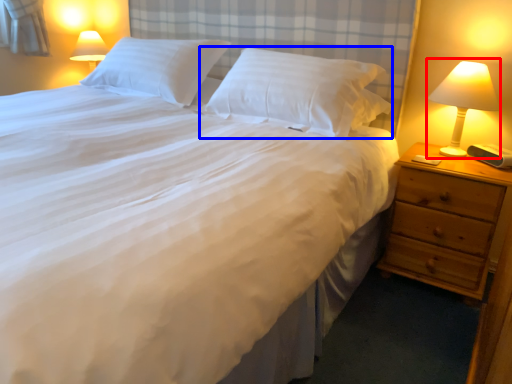
Question: Among these objects, which one is nearest to the camera, bedside lamp (highlighted by a red box) or pillow (highlighted by a blue box)?

Choices:
 (A) bedside lamp
 (B) pillow

Answer: (A)